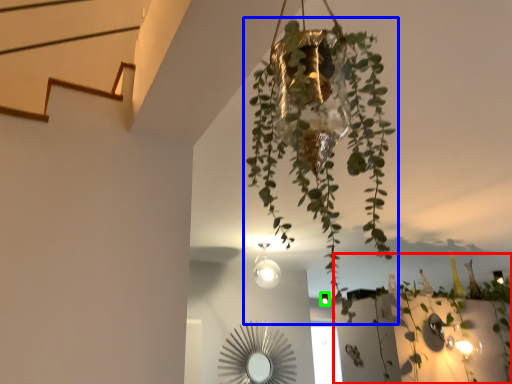
Question: Based on their relative distances, which object is nearer to plant (highlighted by a red box)? Choose from houseplant (highlighted by a blue box) and light fixture (highlighted by a green box).

Choices:
 (A) houseplant
 (B) light fixture

Answer: (B)